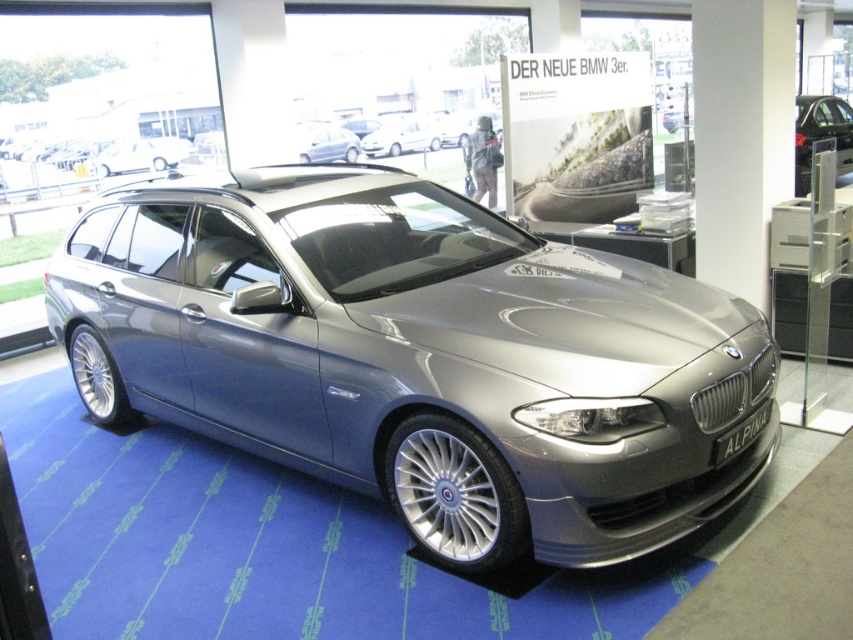
You are planning to move the white glossy hatchback at center to another location. Based on the scene description, can the blue carpet at center accommodate the hatchback in terms of width?

The blue carpet at center has a larger width than the white glossy hatchback at center, so the blue carpet at center can accommodate the hatchback in terms of width.

You are a delivery person needing to navigate through the showroom to place a package near the white glossy hatchback at center. There is a satin silver car at upper right nearby. Given that your cart is 4 feet wide, will there be enough space between the two vehicles to maneuver your cart through?

The distance between the satin silver car at upper right and the white glossy hatchback at center is 28.62 feet. Since your cart is only 4 feet wide, there is more than enough space to maneuver between them.

You are a photographer setting up a shoot in the showroom. You need to position a large reflector between the blue carpet at center and the satin silver metallic car at upper center. Given the spatial relationship between these two objects, will the reflector fit comfortably without overlapping either of them?

The blue carpet at center has a larger size compared to satin silver metallic car at upper center. Since the blue carpet is larger, there is sufficient space between them to place the reflector comfortably without overlapping either object.